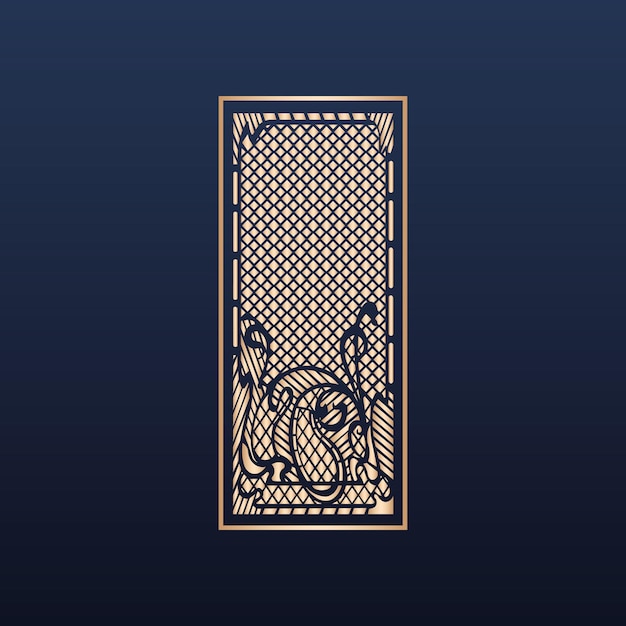
The image size is (626, 626). I want to click on corner, so click(403, 529).